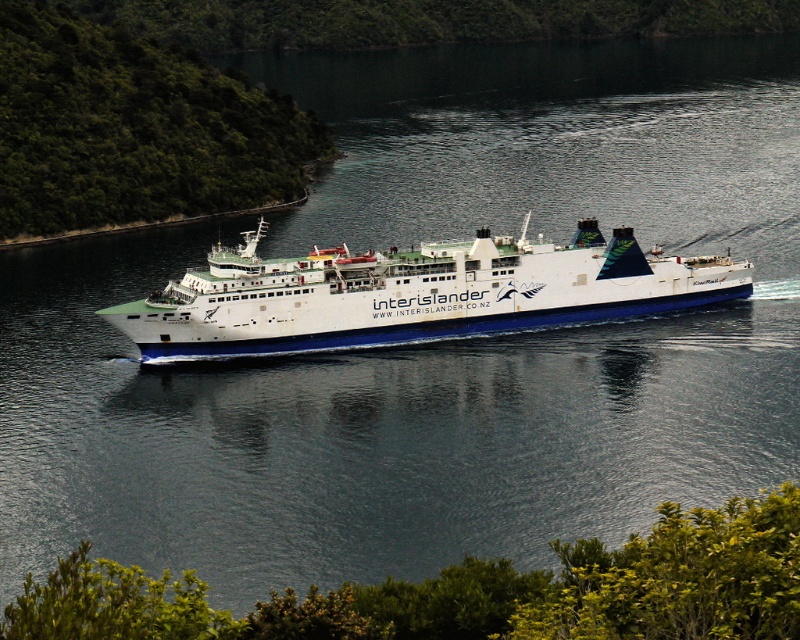
You are standing on the deck of the white matte ferry at center and looking towards the green leafy shrub at lower center. Is the shrub visible from your current position?

The green leafy shrub at lower center is located below the white matte ferry at center, so it is not visible from the deck of the ferry since it is positioned lower down.